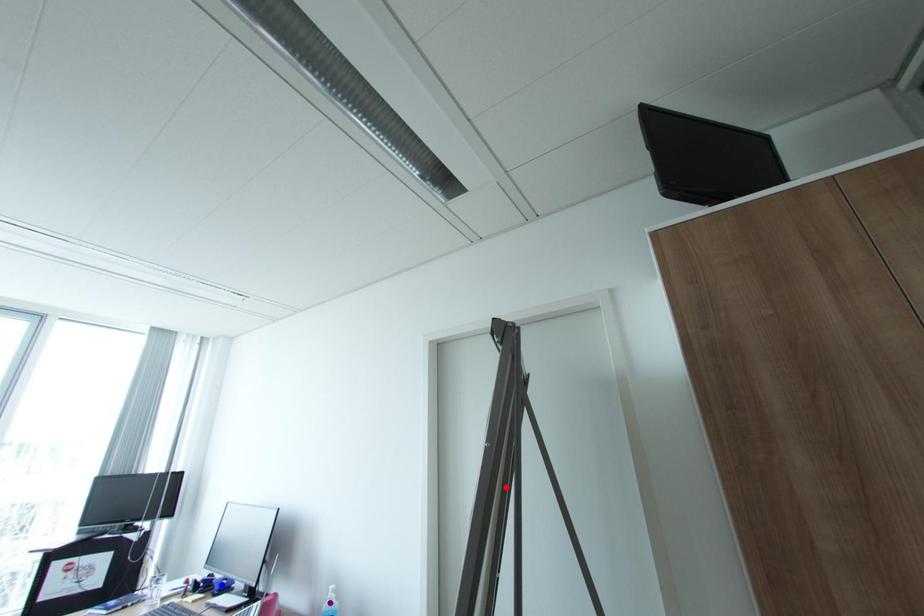
Order these from nearest to farthest:
blue point
purple point
red point

red point, purple point, blue point